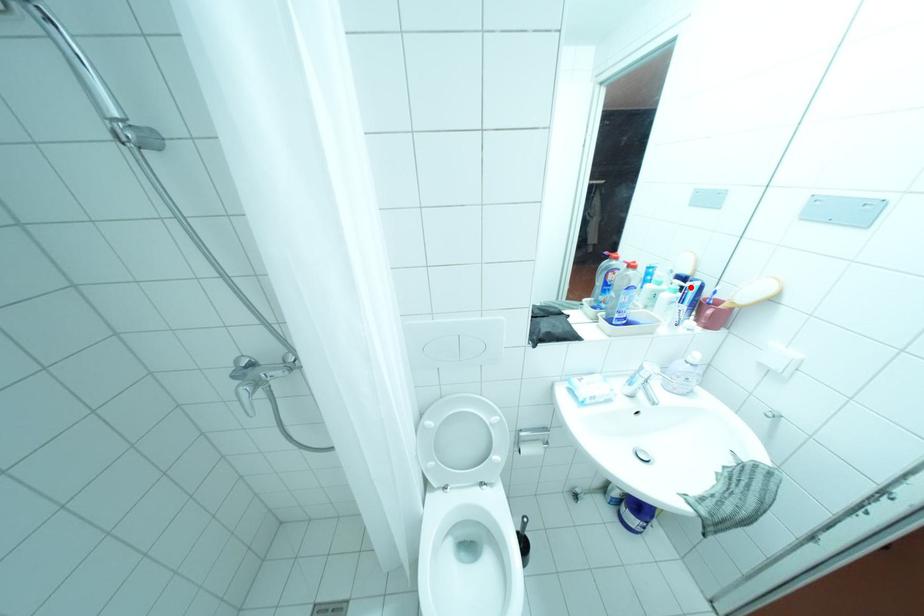
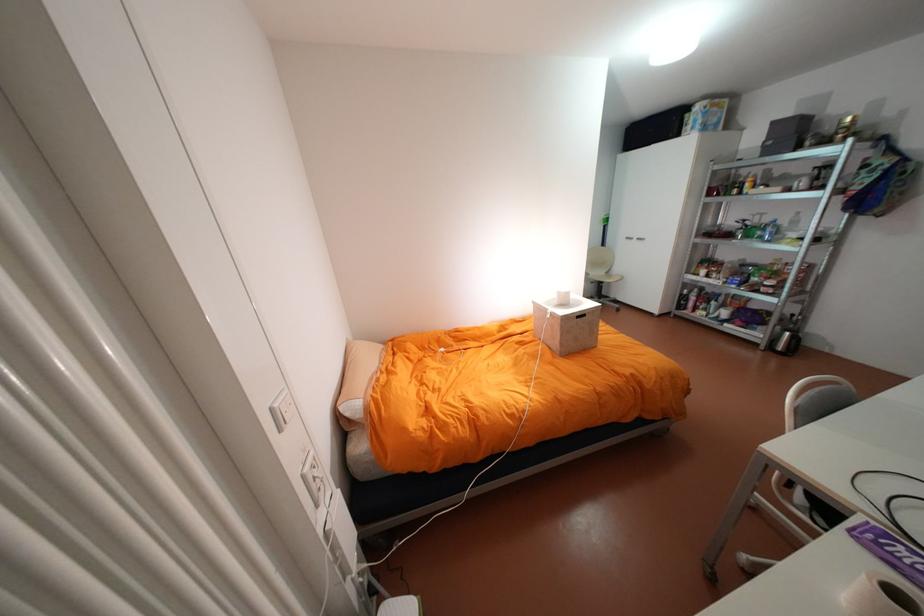
Question: I am providing you with two images of the same scene from different viewpoints. A red point is marked on the first image. At the location where the point appears in image 1, is it still visible in image 2?

Choices:
 (A) Yes
 (B) No

Answer: (B)